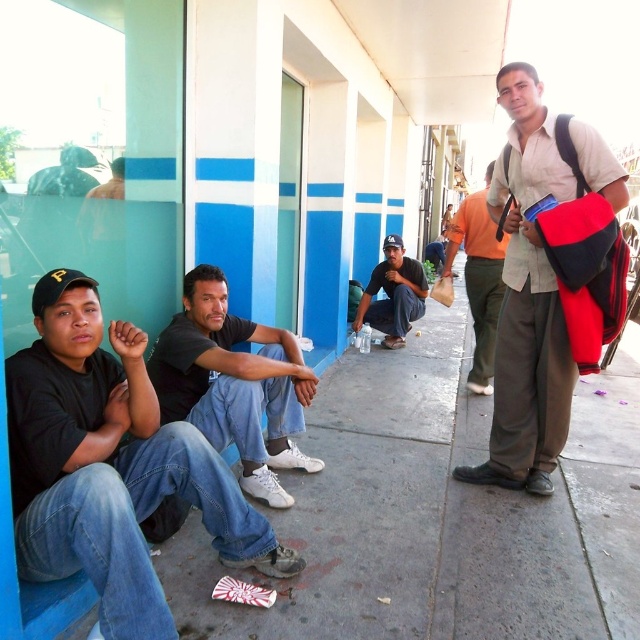
Question: Which is nearer to the black matte shirt at left?

Choices:
 (A) matte black cap at center
 (B) dark gray cotton shirt at center
 (C) light beige shirt at center

Answer: (B)

Question: Does black matte shirt at left have a greater width compared to matte black cap at center?

Choices:
 (A) yes
 (B) no

Answer: (A)

Question: Which object appears closest to the camera in this image?

Choices:
 (A) orange cotton shirt at right
 (B) dark gray cotton shirt at center

Answer: (B)

Question: Which object is farther from the camera taking this photo?

Choices:
 (A) dark gray cotton shirt at center
 (B) orange cotton shirt at right
 (C) light beige shirt at center

Answer: (B)

Question: Considering the relative positions of dark gray cotton shirt at center and orange cotton shirt at right in the image provided, where is dark gray cotton shirt at center located with respect to orange cotton shirt at right?

Choices:
 (A) left
 (B) right

Answer: (A)

Question: Can you confirm if dark gray cotton shirt at center is positioned above matte black cap at center?

Choices:
 (A) yes
 (B) no

Answer: (B)